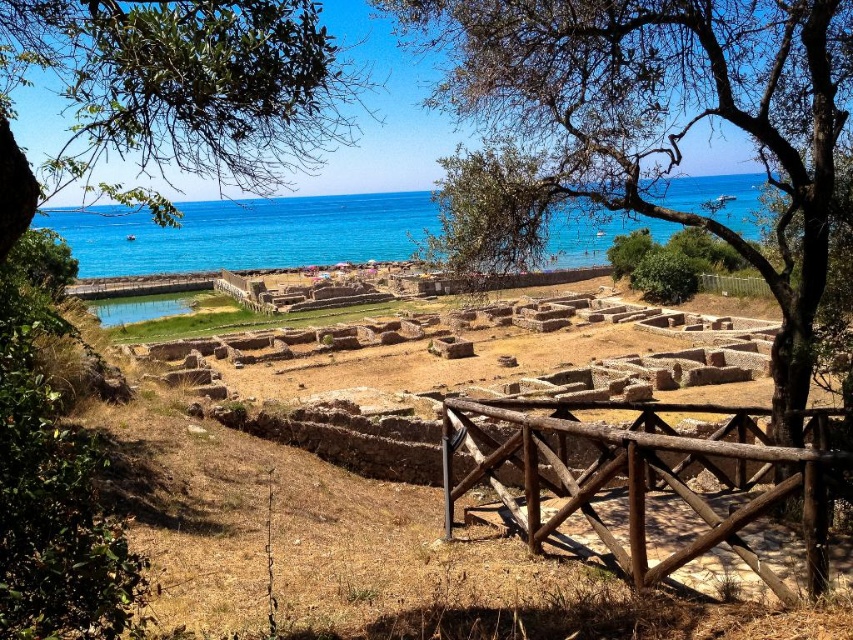
Question: In this image, where is green leafy tree at upper left located relative to wooden fence at center-right?

Choices:
 (A) left
 (B) right

Answer: (A)

Question: Which of the following is the farthest from the observer?

Choices:
 (A) (746, 6)
 (B) (740, 285)
 (C) (82, 138)

Answer: (B)

Question: Considering the real-world distances, which object is closest to the blue water at upper center?

Choices:
 (A) green leafy tree at center
 (B) brown wooden fence at lower right

Answer: (A)

Question: Observing the image, what is the correct spatial positioning of green leafy tree at upper left in reference to brown wooden fence at lower right?

Choices:
 (A) right
 (B) left

Answer: (B)

Question: Is green leafy tree at center below wooden fence at center-right?

Choices:
 (A) no
 (B) yes

Answer: (A)

Question: Estimate the real-world distances between objects in this image. Which object is closer to the green leafy tree at upper left?

Choices:
 (A) green leafy tree at center
 (B) blue water at upper center
 (C) brown wooden fence at lower right

Answer: (A)